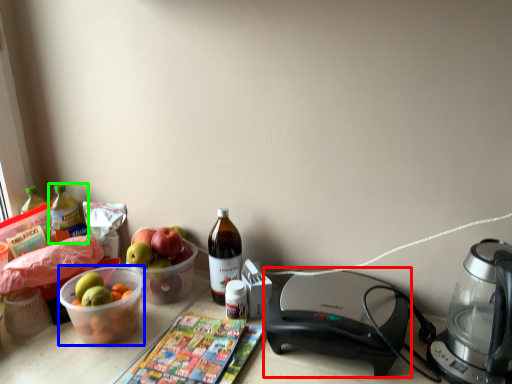
Question: Considering the real-world distances, which object is closest to appliance (highlighted by a red box)? bowl (highlighted by a blue box) or bottle (highlighted by a green box).

Choices:
 (A) bowl
 (B) bottle

Answer: (A)